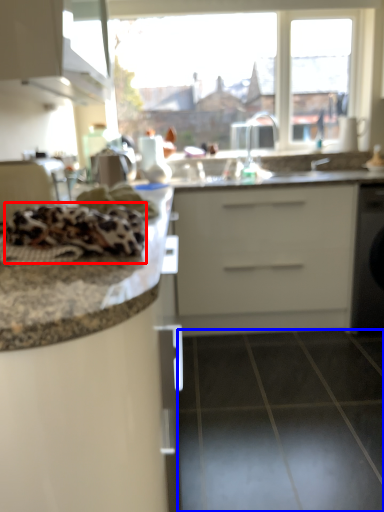
Question: Which object appears closest to the camera in this image, material (highlighted by a red box) or tile (highlighted by a blue box)?

Choices:
 (A) material
 (B) tile

Answer: (A)